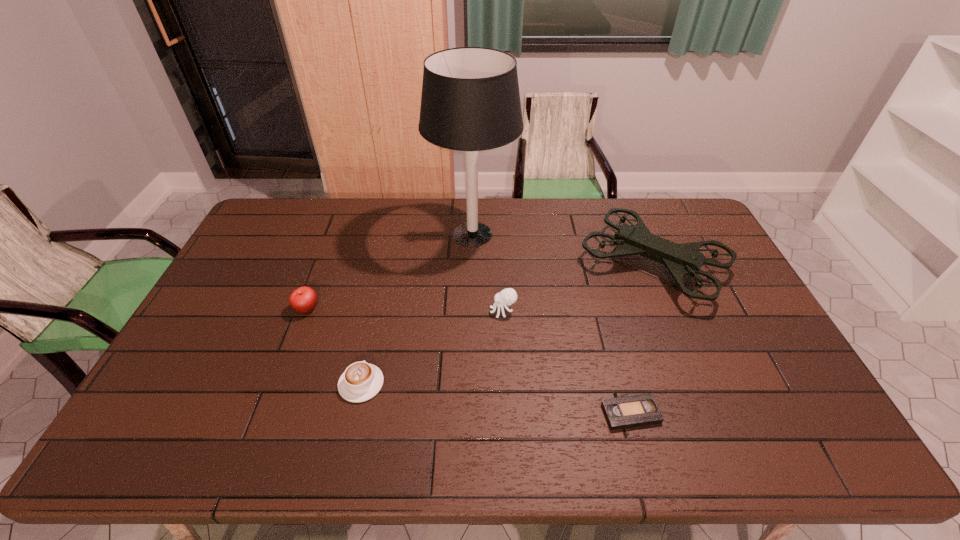
Where is `vacant point located between the second tallest object and the shortest object`? This screenshot has width=960, height=540. vacant point located between the second tallest object and the shortest object is located at coordinates (641, 339).

I want to click on unoccupied area between the fifth object from right to left and the tallest object, so click(417, 309).

I want to click on blank region between the leftmost object and the cappuccino, so click(x=334, y=346).

The height and width of the screenshot is (540, 960). I want to click on unoccupied position between the leftmost object and the octopus, so click(405, 310).

You are a GUI agent. You are given a task and a screenshot of the screen. Output one action in this format:
    pyautogui.click(x=<x>, y=<y>)
    Task: Click on the vacant space that's between the drone and the second shortest object
    This screenshot has height=540, width=960.
    Given the screenshot: What is the action you would take?
    pyautogui.click(x=507, y=325)

Where is `free space that is in between the apple and the second tallest object`? This screenshot has height=540, width=960. free space that is in between the apple and the second tallest object is located at coordinates (480, 287).

This screenshot has height=540, width=960. Find the location of `vacant area between the octopus and the table lamp`. vacant area between the octopus and the table lamp is located at coordinates (488, 273).

The image size is (960, 540). Find the location of `empty space between the videotape and the second tallest object`. empty space between the videotape and the second tallest object is located at coordinates (641, 339).

This screenshot has width=960, height=540. Identify the location of unoccupied position between the second tallest object and the table lamp. (563, 249).

This screenshot has width=960, height=540. I want to click on object that stands as the third closest to the videotape, so click(470, 101).